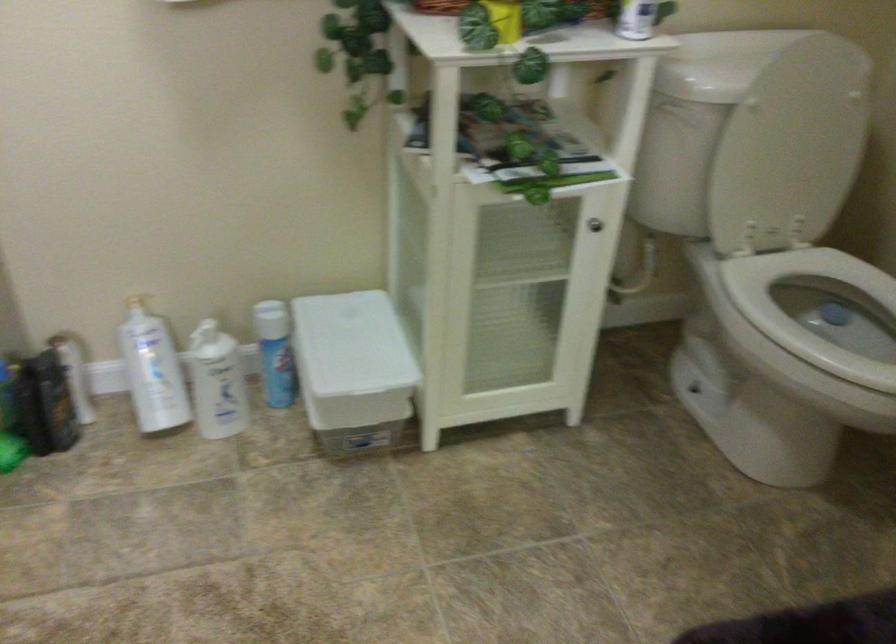
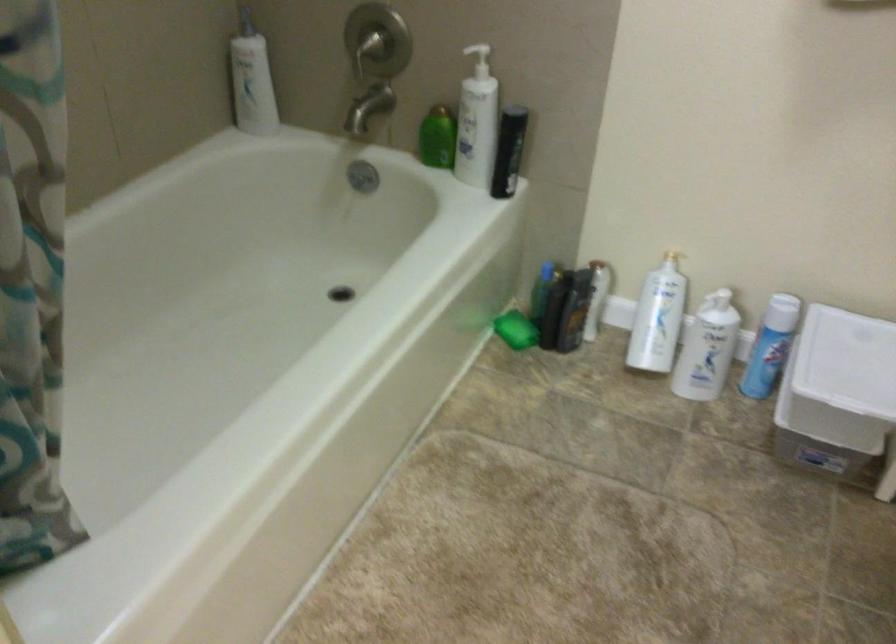
Where in the second image is the point corresponding to [211,335] from the first image?

(719, 301)